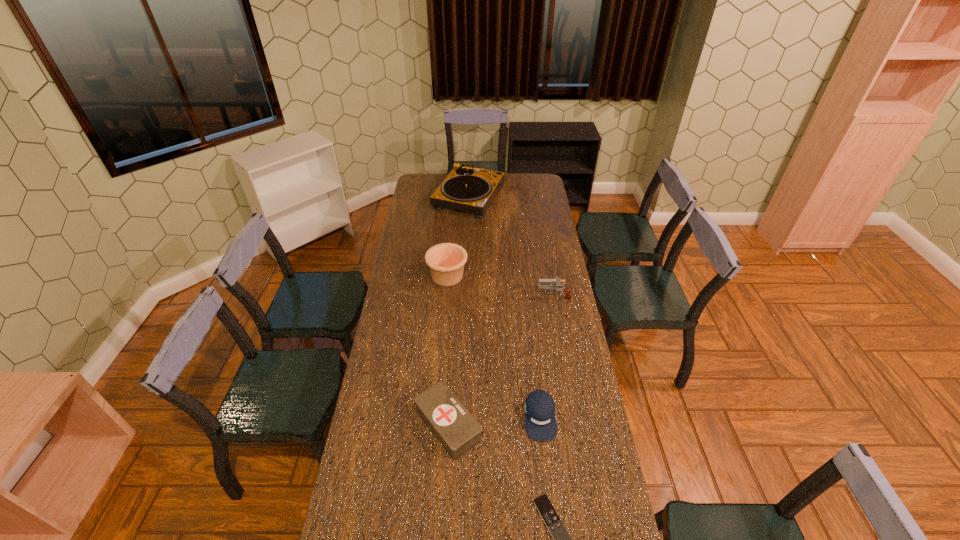
Find the location of a particular element. free space located 0.160m on the back of the first-aid kit is located at coordinates (452, 359).

Find the location of `vacant point located 0.250m on the front-facing side of the baseball cap`. vacant point located 0.250m on the front-facing side of the baseball cap is located at coordinates (551, 520).

Where is `object at the far edge`? The width and height of the screenshot is (960, 540). object at the far edge is located at coordinates (468, 189).

The image size is (960, 540). In order to click on record player located at the left edge in this screenshot , I will do `click(468, 189)`.

Find the location of a particular element. The width and height of the screenshot is (960, 540). pottery at the left edge is located at coordinates (446, 261).

I want to click on gun that is at the right edge, so click(558, 283).

Where is `baseball cap that is positioned at the right edge`? Image resolution: width=960 pixels, height=540 pixels. baseball cap that is positioned at the right edge is located at coordinates (540, 422).

Where is `object present at the far left corner`? object present at the far left corner is located at coordinates (468, 189).

Where is `vacant space at the far edge of the desktop`? This screenshot has height=540, width=960. vacant space at the far edge of the desktop is located at coordinates (441, 181).

In the image, there is a desktop. Identify the location of vacant space at the left edge. click(x=422, y=215).